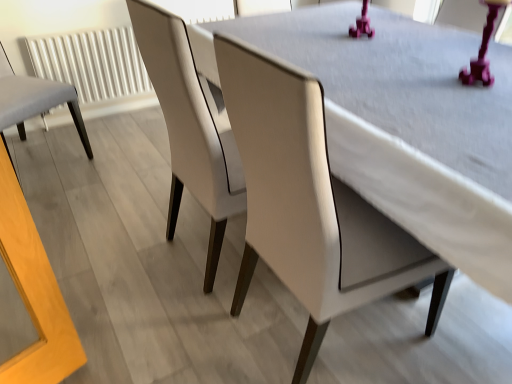
You are a GUI agent. You are given a task and a screenshot of the screen. Output one action in this format:
    pyautogui.click(x=<x>, y=<y>)
    Task: Click on the vacant space in matte white chair at center, arranged as the 2th chair when viewed from the left (from a real-world perspective)
    This screenshot has height=384, width=512.
    Given the screenshot: What is the action you would take?
    pyautogui.click(x=206, y=248)